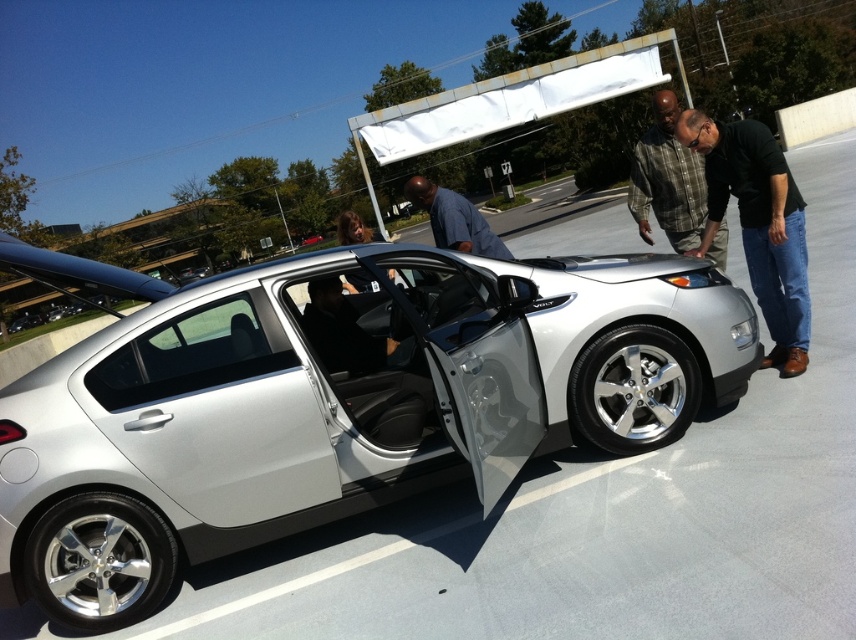
Question: Which of the following is the farthest from the observer?

Choices:
 (A) (169, 577)
 (B) (776, 164)
 (C) (405, 189)

Answer: (C)

Question: Which is farther from the matte blue shirt at center?

Choices:
 (A) black leather pants at lower right
 (B) plaid shirt at center
 (C) silver metallic sedan at center

Answer: (A)

Question: In this image, where is satin silver door at center located relative to black leather pants at lower right?

Choices:
 (A) right
 (B) left

Answer: (B)

Question: Can you confirm if satin silver door at center is thinner than matte black car door at center?

Choices:
 (A) no
 (B) yes

Answer: (B)

Question: Where is black leather pants at lower right located in relation to plaid shirt at center in the image?

Choices:
 (A) below
 (B) above

Answer: (A)

Question: Which object is positioned farthest from the plaid shirt at center?

Choices:
 (A) silver metallic sedan at center
 (B) matte black car door at center

Answer: (B)